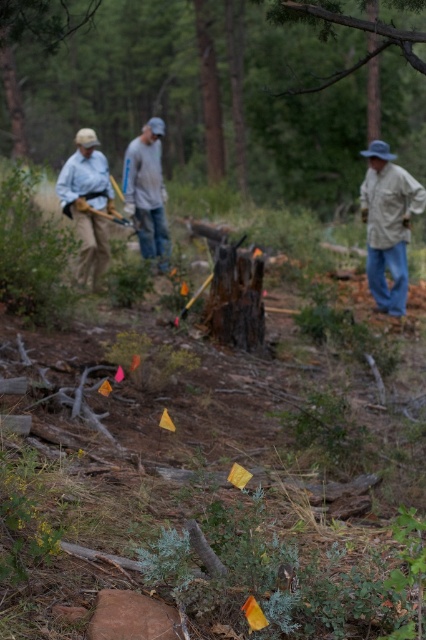
Question: Observing the image, what is the correct spatial positioning of matte blue shirt at left in reference to gray cotton shirt at center?

Choices:
 (A) above
 (B) below

Answer: (B)

Question: Is light beige fabric shirt at right thinner than matte blue shirt at left?

Choices:
 (A) yes
 (B) no

Answer: (B)

Question: Which object is positioned farthest from the dark brown wood stump at center?

Choices:
 (A) matte blue shirt at left
 (B) gray cotton shirt at center

Answer: (A)

Question: Based on their relative distances, which object is farther from the gray cotton shirt at center?

Choices:
 (A) light beige fabric shirt at right
 (B) dark brown wood stump at center

Answer: (B)

Question: Is dark brown wood stump at center positioned behind light beige fabric shirt at right?

Choices:
 (A) no
 (B) yes

Answer: (A)

Question: Which is farther from the gray cotton shirt at center?

Choices:
 (A) matte blue shirt at left
 (B) light beige fabric shirt at right

Answer: (B)